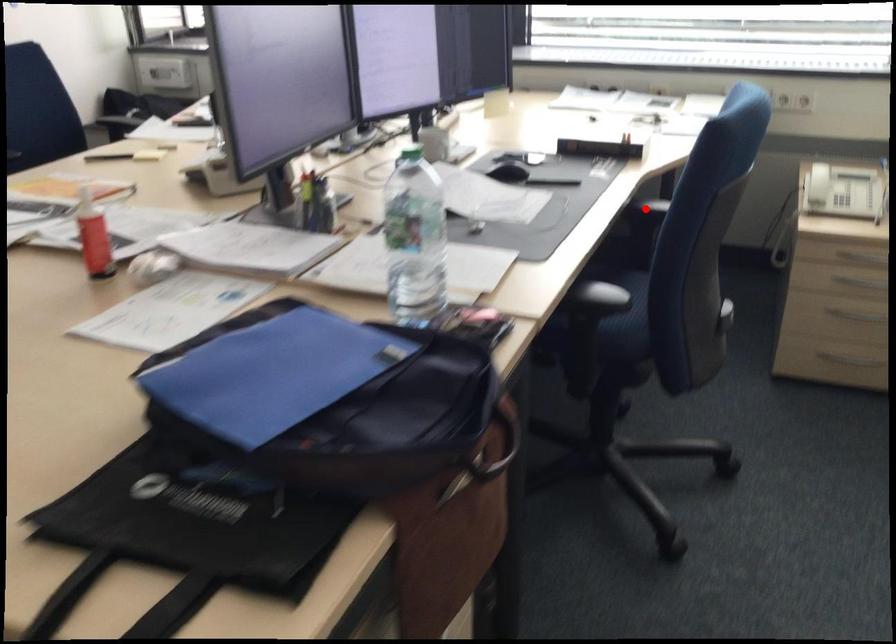
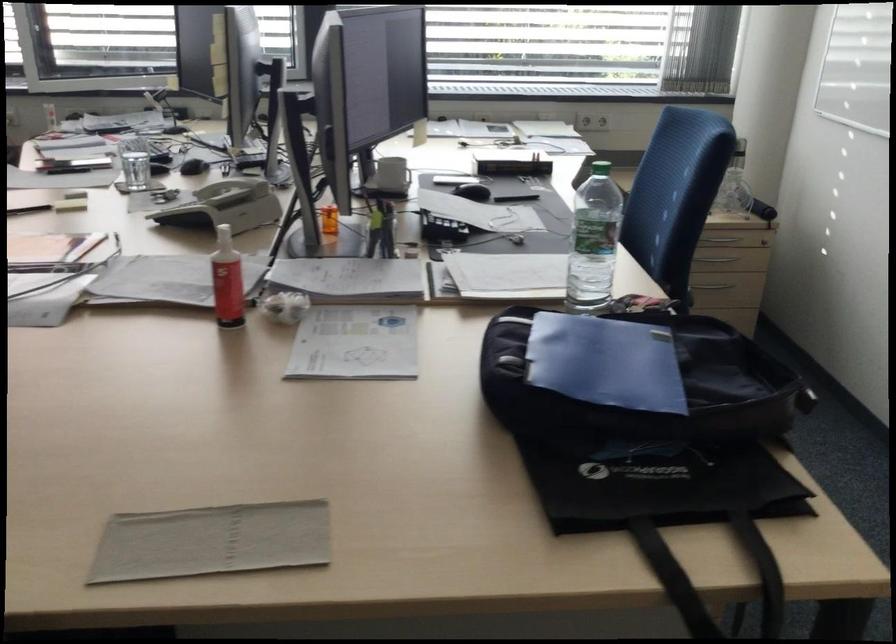
Question: I am providing you with two images of the same scene from different viewpoints. A red point is marked on the first image. At the location where the point appears in image 1, is it still visible in image 2?

Choices:
 (A) Yes
 (B) No

Answer: (B)